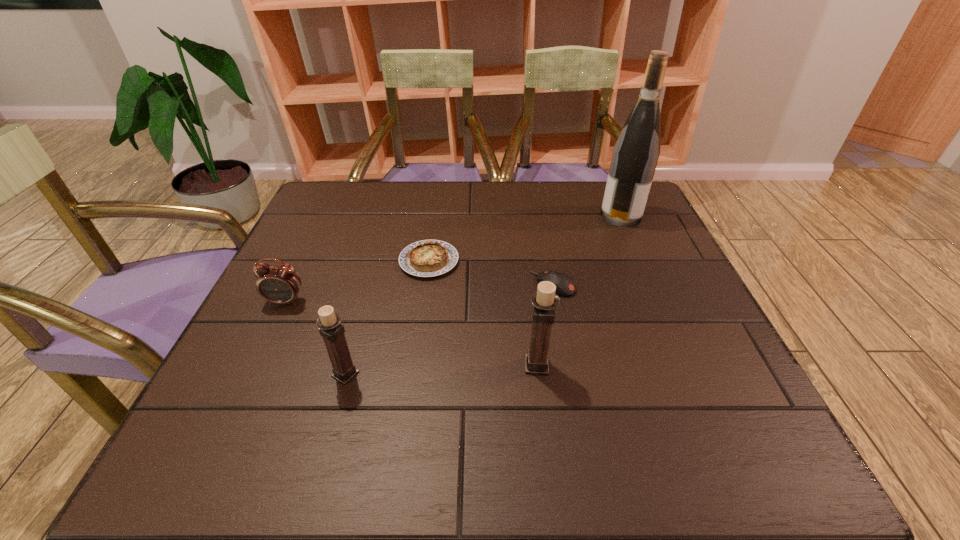
Identify the location of empty location between the computer mouse and the third object from left to right. (491, 273).

The image size is (960, 540). In order to click on free point between the shorter candle holder and the wine bottle in this screenshot , I will do `click(483, 295)`.

Where is `blank region between the left candle holder and the right candle holder`? This screenshot has width=960, height=540. blank region between the left candle holder and the right candle holder is located at coordinates (442, 370).

The width and height of the screenshot is (960, 540). I want to click on vacant point located between the right candle holder and the shorter candle holder, so click(442, 370).

This screenshot has height=540, width=960. I want to click on free space between the tallest object and the fourth shortest object, so click(x=483, y=295).

At what (x,y) coordinates should I click in order to perform the action: click on vacant region between the shortest object and the second tallest object. Please return your answer as a coordinate pair (x, y). The image size is (960, 540). Looking at the image, I should click on (483, 313).

What are the coordinates of `empty space that is in between the alarm clock and the shorter candle holder` in the screenshot? It's located at (316, 338).

Where is `free space between the computer mouse and the left candle holder`? The width and height of the screenshot is (960, 540). free space between the computer mouse and the left candle holder is located at coordinates (449, 329).

Select which object appears as the fourth closest to the alarm clock. Please provide its 2D coordinates. Your answer should be formatted as a tuple, i.e. [(x, y)], where the tuple contains the x and y coordinates of a point satisfying the conditions above.

[(564, 284)]

Identify which object is the third closest to the fourth object from right to left. Please provide its 2D coordinates. Your answer should be formatted as a tuple, i.e. [(x, y)], where the tuple contains the x and y coordinates of a point satisfying the conditions above.

[(331, 330)]